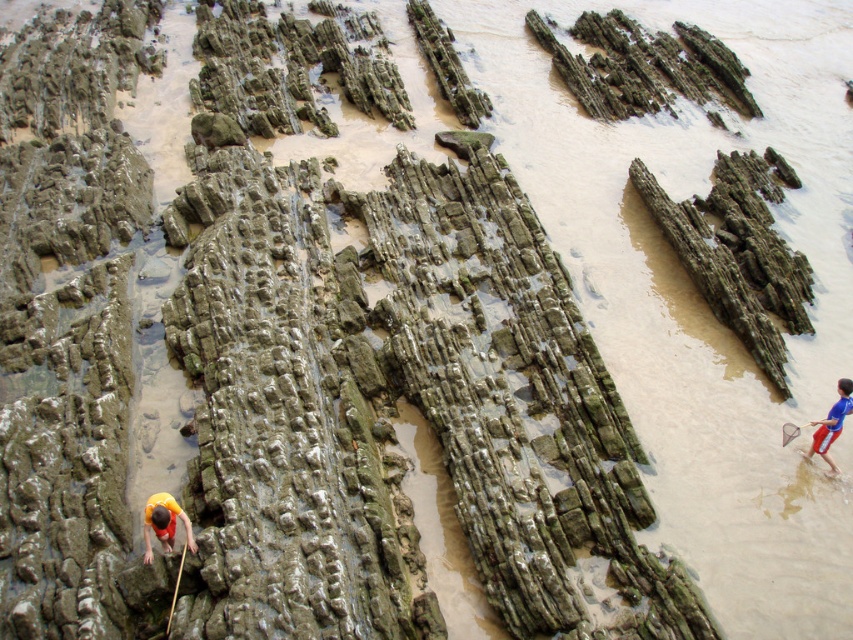
You are standing on the rocky shoreline and notice a yellow fabric at lower left and a blue jersey at lower right. Which object takes up more area on the ground?

The blue jersey at lower right occupies more space than the yellow fabric at lower left, so it takes up more area on the ground.

You are standing on the rocky shoreline and see the yellow fabric at lower left and the blue jersey at lower right. Which object is nearer to you?

The yellow fabric at lower left is closer to the viewer than the blue jersey at lower right.

You are standing on the rocky shoreline and notice two items washed ashore. The yellow fabric at lower left and the blue jersey at lower right. Which item is closer to the water level?

The yellow fabric at lower left is shorter than the blue jersey at lower right, so it is closer to the water level.